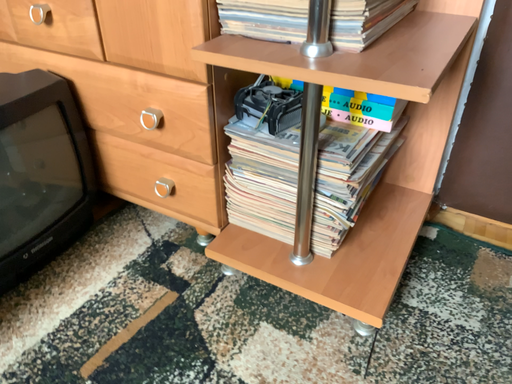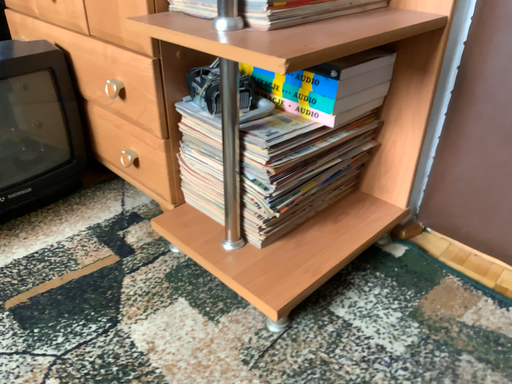
Question: How did the camera likely rotate when shooting the video?

Choices:
 (A) rotated right
 (B) rotated left

Answer: (B)